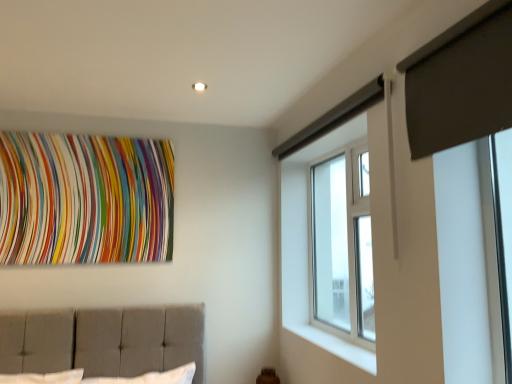
Where is `vacant space situated above white smooth window sill at lower right (from a real-world perspective)`? Image resolution: width=512 pixels, height=384 pixels. vacant space situated above white smooth window sill at lower right (from a real-world perspective) is located at coordinates (337, 338).